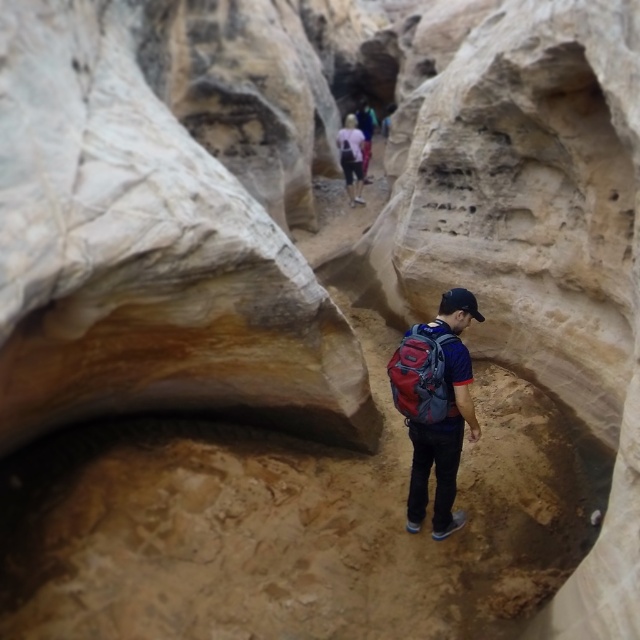
From the picture: You are hiking through a narrow rocky canyon and see a matte blue backpack at center and a pink fabric shirt at upper center. Which object is positioned lower in the scene?

The matte blue backpack at center is positioned below the pink fabric shirt at upper center, so the backpack is lower.